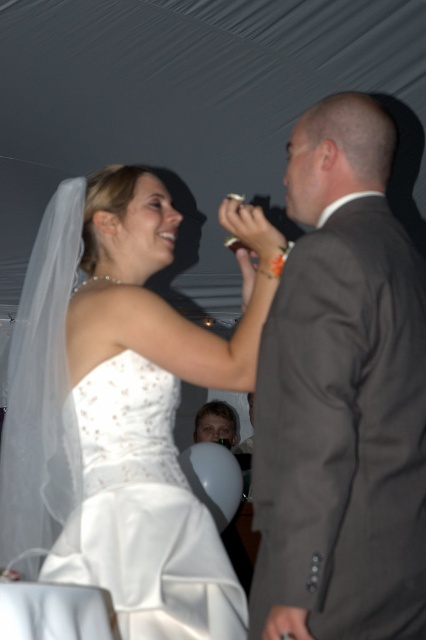
You are a photographer at the wedding reception and want to capture a closeup shot of the point at position point [226,611] and point [158,458]. Which point should you focus on to ensure it appears clearer in the photo?

Point [226,611] is closer to the camera than point [158,458], so focusing on point [226,611] will ensure it appears clearer in the photo.

You are a photographer at the wedding reception. You need to capture a photo of the white satin dress at upper left and the matte gray suit at right. Based on their positions, which one is located to the left of the other?

The white satin dress at upper left is positioned on the left side of matte gray suit at right, so the white satin dress at upper left is to the left of the matte gray suit at right.